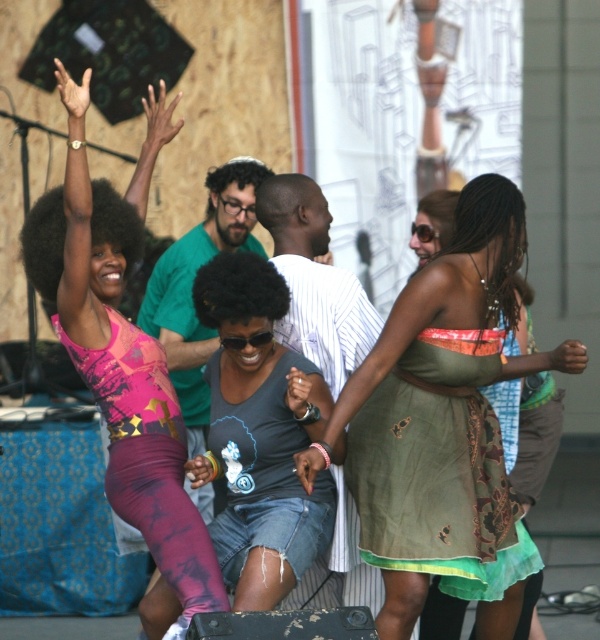
Is point (170, 426) less distant than point (247, 604)?

That is False.

Which is more to the left, pink mesh tank top at upper left or denim shorts at center?

pink mesh tank top at upper left

Who is more distant from viewer, (206, 580) or (252, 360)?

Positioned behind is point (252, 360).

Image resolution: width=600 pixels, height=640 pixels. Identify the location of pink mesh tank top at upper left. [122, 356].

Does green textured dress at center appear on the right side of denim shorts at center?

Indeed, green textured dress at center is positioned on the right side of denim shorts at center.

From the picture: Who is more distant from viewer, (355,481) or (226,525)?

The point (355,481) is more distant.

Who is more distant from viewer, (514, 515) or (253, 483)?

The point (514, 515) is more distant.

This screenshot has height=640, width=600. What are the coordinates of `green textured dress at center` in the screenshot? It's located at (433, 413).

Is the position of green textured dress at center less distant than that of pink mesh tank top at upper left?

No, green textured dress at center is further to the viewer.

Consider the image. Can you confirm if green textured dress at center is positioned below pink mesh tank top at upper left?

Yes, green textured dress at center is below pink mesh tank top at upper left.

I want to click on green textured dress at center, so click(433, 413).